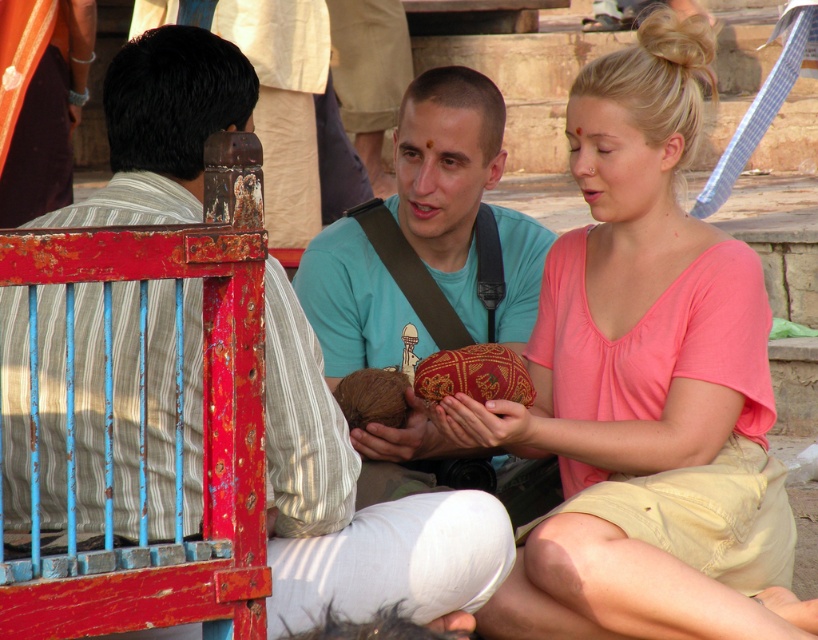
Is pink matte shirt at center positioned in front of matte teal shirt at center?

That is True.

Does pink matte shirt at center have a smaller size compared to matte teal shirt at center?

No, pink matte shirt at center is not smaller than matte teal shirt at center.

Which is in front, point (551, 356) or point (446, 160)?

Point (551, 356) is more forward.

At what (x,y) coordinates should I click in order to perform the action: click on pink matte shirt at center. Please return your answer as a coordinate pair (x, y). The height and width of the screenshot is (640, 818). Looking at the image, I should click on (645, 387).

Who is more forward, (590, 228) or (286, 340)?

Point (286, 340) is more forward.

Who is more distant from viewer, (751,582) or (464,589)?

The point (751,582) is behind.

Between point (567, 387) and point (178, 104), which one is positioned in front?

Positioned in front is point (178, 104).

Identify the location of pink matte shirt at center. The image size is (818, 640). (645, 387).

Image resolution: width=818 pixels, height=640 pixels. What are the coordinates of `matte brown coconut at center` in the screenshot? It's located at (353, 504).

Is matte brown coconut at center to the right of matte teal shirt at center from the viewer's perspective?

Incorrect, matte brown coconut at center is not on the right side of matte teal shirt at center.

Does point (308, 596) come behind point (554, 474)?

No, it is in front of (554, 474).

Where is `matte brown coconut at center`? matte brown coconut at center is located at coordinates (353, 504).